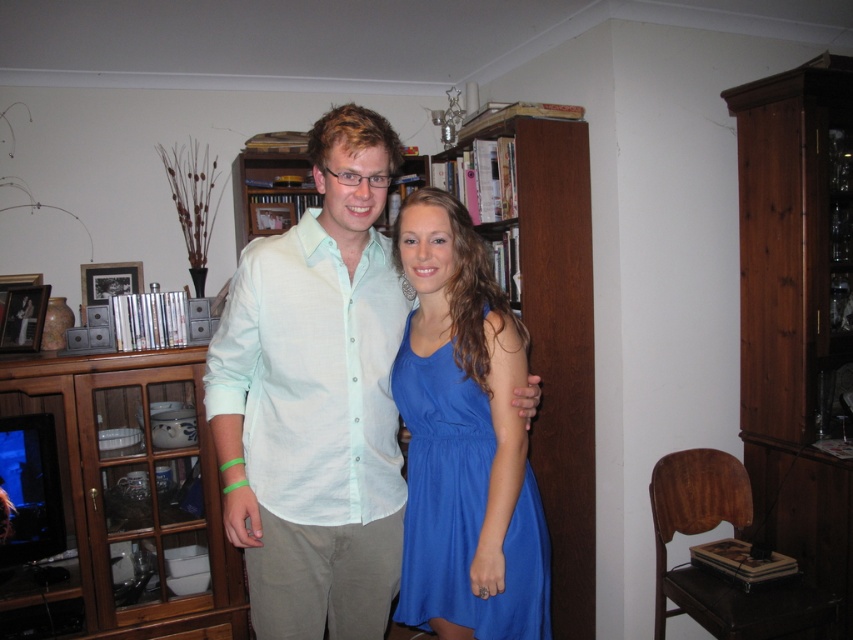
You are a delivery person trying to place a small package between the wooden bookshelf at center and the blue satin dress at center. Can you fit the package in the space between them if the package requires 3 feet of space?

The wooden bookshelf at center and blue satin dress at center are 3.52 feet apart, so yes, the package requiring 3 feet of space can fit between them since the distance is sufficient.

You are standing in the living room and want to place a small plant between the two points marked as point (160,512) and point (468,378). According to the image, which point should the plant be closer to so it is positioned in front of the wooden cabinet with glass doors?

The plant should be closer to point (468,378) because point (160,512) is behind point (468,378), so placing it near the front point would be in front of the wooden cabinet with glass doors.